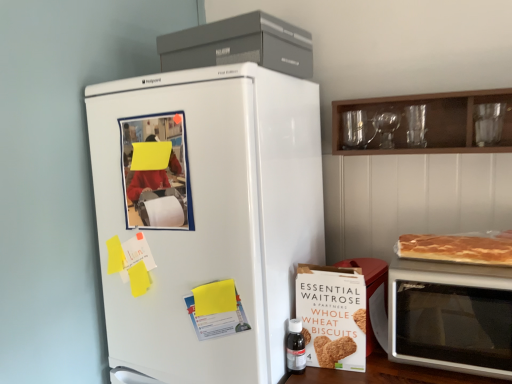
Question: Is transparent plastic bottle at lower right at the back of silver metallic microwave at right?

Choices:
 (A) no
 (B) yes

Answer: (A)

Question: Considering the relative sizes of silver metallic microwave at right and transparent plastic bottle at lower right in the image provided, is silver metallic microwave at right thinner than transparent plastic bottle at lower right?

Choices:
 (A) yes
 (B) no

Answer: (B)

Question: Can you confirm if silver metallic microwave at right is smaller than transparent plastic bottle at lower right?

Choices:
 (A) yes
 (B) no

Answer: (B)

Question: Is silver metallic microwave at right at the left side of transparent plastic bottle at lower right?

Choices:
 (A) yes
 (B) no

Answer: (B)

Question: Considering the relative sizes of silver metallic microwave at right and transparent plastic bottle at lower right in the image provided, is silver metallic microwave at right bigger than transparent plastic bottle at lower right?

Choices:
 (A) yes
 (B) no

Answer: (A)

Question: Considering the relative positions of white matte refrigerator at left and wooden cabinet at upper right in the image provided, is white matte refrigerator at left to the left or to the right of wooden cabinet at upper right?

Choices:
 (A) left
 (B) right

Answer: (A)

Question: From a real-world perspective, is white matte refrigerator at left physically located above or below wooden cabinet at upper right?

Choices:
 (A) above
 (B) below

Answer: (B)

Question: Is white matte refrigerator at left situated inside wooden cabinet at upper right or outside?

Choices:
 (A) outside
 (B) inside

Answer: (A)

Question: Is point (162, 119) closer or farther from the camera than point (348, 105)?

Choices:
 (A) farther
 (B) closer

Answer: (B)

Question: Which is correct: white cardboard box of whole wheat biscuits at lower right is inside matte gray refrigerator at upper center, or outside of it?

Choices:
 (A) inside
 (B) outside

Answer: (B)

Question: From a real-world perspective, relative to matte gray refrigerator at upper center, is white cardboard box of whole wheat biscuits at lower right vertically above or below?

Choices:
 (A) below
 (B) above

Answer: (A)

Question: In the image, is white cardboard box of whole wheat biscuits at lower right on the left side or the right side of matte gray refrigerator at upper center?

Choices:
 (A) right
 (B) left

Answer: (A)

Question: Relative to matte gray refrigerator at upper center, is white cardboard box of whole wheat biscuits at lower right in front or behind?

Choices:
 (A) front
 (B) behind

Answer: (B)

Question: From their relative heights in the image, would you say golden brown flaky pancake at right is taller or shorter than white matte refrigerator at left?

Choices:
 (A) short
 (B) tall

Answer: (A)

Question: In the image, is golden brown flaky pancake at right positioned in front of or behind white matte refrigerator at left?

Choices:
 (A) behind
 (B) front

Answer: (A)